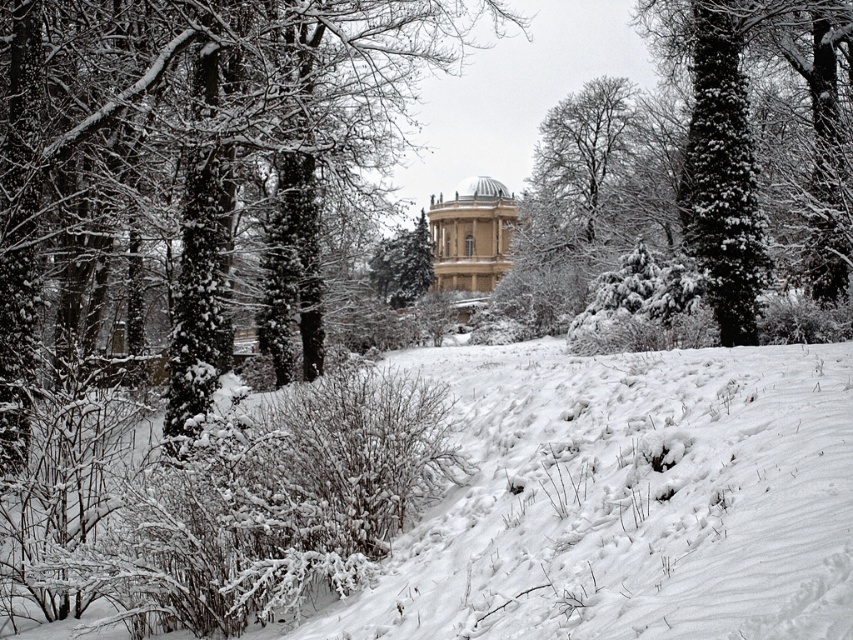
Question: Among these points, which one is farthest from the camera?

Choices:
 (A) (360, 16)
 (B) (433, 244)

Answer: (B)

Question: Which of the following is the closest to the observer?

Choices:
 (A) (339, 150)
 (B) (489, 269)

Answer: (A)

Question: Observing the image, what is the correct spatial positioning of snow-covered tree at center in reference to white marble gazebo at center?

Choices:
 (A) right
 (B) left

Answer: (B)

Question: Is snow-covered tree at center further to the viewer compared to white fluffy snow at center?

Choices:
 (A) no
 (B) yes

Answer: (B)

Question: Can you confirm if white fluffy snow at center is wider than white marble gazebo at center?

Choices:
 (A) yes
 (B) no

Answer: (A)

Question: Which is farther from the white marble gazebo at center?

Choices:
 (A) white fluffy snow at center
 (B) snow-covered tree at center

Answer: (A)